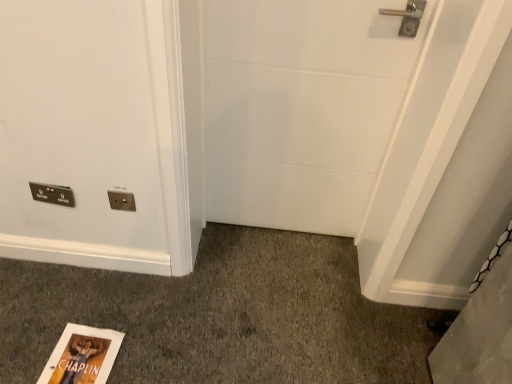
Measure the distance between metallic silver light switch at lower left and camera.

metallic silver light switch at lower left and camera are 4.78 feet apart.

Identify the location of white matte door at center. (301, 108).

Identify the location of matte gold electrical outlet at center. The height and width of the screenshot is (384, 512). (121, 201).

From the image's perspective, is white matte door at center located above matte gold electrical outlet at center?

Yes, from the image's perspective, white matte door at center is on top of matte gold electrical outlet at center.

Considering the relative positions of white matte door at center and matte gold electrical outlet at center in the image provided, is white matte door at center to the right of matte gold electrical outlet at center from the viewer's perspective?

Yes, white matte door at center is to the right of matte gold electrical outlet at center.

From the picture: Who is smaller, white matte door at center or matte gold electrical outlet at center?

matte gold electrical outlet at center is smaller.

Considering the positions of point (222, 42) and point (129, 197), is point (222, 42) closer or farther from the camera than point (129, 197)?

Point (222, 42).

Is matte gold electrical outlet at center positioned far away from metallic silver light switch at lower left?

No, matte gold electrical outlet at center is not far away from metallic silver light switch at lower left.

From the image's perspective, which is below, matte gold electrical outlet at center or metallic silver light switch at lower left?

matte gold electrical outlet at center.

The image size is (512, 384). Find the location of `electric outlet in front of the metallic silver light switch at lower left`. electric outlet in front of the metallic silver light switch at lower left is located at coordinates (121, 201).

Which is behind, matte gold electrical outlet at center or metallic silver light switch at lower left?

metallic silver light switch at lower left is further from the camera.

Consider the image. Which is more to the right, metallic silver light switch at lower left or matte gold electrical outlet at center?

Positioned to the right is matte gold electrical outlet at center.

Considering the relative sizes of metallic silver light switch at lower left and matte gold electrical outlet at center in the image provided, is metallic silver light switch at lower left wider than matte gold electrical outlet at center?

Indeed, metallic silver light switch at lower left has a greater width compared to matte gold electrical outlet at center.

Which of these two, metallic silver light switch at lower left or matte gold electrical outlet at center, stands shorter?

With less height is matte gold electrical outlet at center.

From the image's perspective, between white matte door at center and metallic silver light switch at lower left, which one is located above?

From the image's view, white matte door at center is above.

Could you tell me if white matte door at center is facing metallic silver light switch at lower left?

No, white matte door at center is not turned towards metallic silver light switch at lower left.

Is white matte door at center taller than metallic silver light switch at lower left?

Yes.

Consider the image. Is white matte door at center not near metallic silver light switch at lower left?

No.

Between metallic silver light switch at lower left and white matte door at center, which one has larger width?

With larger width is white matte door at center.

Considering the sizes of objects metallic silver light switch at lower left and white matte door at center in the image provided, who is shorter, metallic silver light switch at lower left or white matte door at center?

With less height is metallic silver light switch at lower left.

What's the angular difference between metallic silver light switch at lower left and white matte door at center's facing directions?

They differ by 0.452 degrees in their facing directions.

From a real-world perspective, is metallic silver light switch at lower left positioned above or below white matte door at center?

metallic silver light switch at lower left is situated lower than white matte door at center in the real world.

Consider the image. From a real-world perspective, is matte gold electrical outlet at center positioned under white matte door at center based on gravity?

Yes, from a real-world perspective, matte gold electrical outlet at center is under white matte door at center.

Considering the sizes of objects matte gold electrical outlet at center and white matte door at center in the image provided, who is smaller, matte gold electrical outlet at center or white matte door at center?

With smaller size is matte gold electrical outlet at center.

Is matte gold electrical outlet at center not near white matte door at center?

They are positioned close to each other.

Is point (117, 193) positioned behind point (256, 116)?

No, it is in front of (256, 116).

Locate an element on the screen. This screenshot has height=384, width=512. electric outlet lying on the left of white matte door at center is located at coordinates (121, 201).

Identify the location of electric outlet that appears in front of the metallic silver light switch at lower left. (121, 201).

Estimate the real-world distances between objects in this image. Which object is further from matte gold electrical outlet at center, metallic silver light switch at lower left or white matte door at center?

Based on the image, white matte door at center appears to be further to matte gold electrical outlet at center.

From the image, which object appears to be nearer to matte gold electrical outlet at center, white matte door at center or metallic silver light switch at lower left?

metallic silver light switch at lower left lies closer to matte gold electrical outlet at center than the other object.

Considering their positions, is matte gold electrical outlet at center positioned closer to metallic silver light switch at lower left than white matte door at center?

Based on the image, matte gold electrical outlet at center appears to be nearer to metallic silver light switch at lower left.

From the image, which object appears to be farther from white matte door at center, metallic silver light switch at lower left or matte gold electrical outlet at center?

Among the two, metallic silver light switch at lower left is located further to white matte door at center.

From the picture: Estimate the real-world distances between objects in this image. Which object is closer to metallic silver light switch at lower left, white matte door at center or matte gold electrical outlet at center?

Among the two, matte gold electrical outlet at center is located nearer to metallic silver light switch at lower left.

Considering their positions, is matte gold electrical outlet at center positioned further to white matte door at center than metallic silver light switch at lower left?

metallic silver light switch at lower left is further to white matte door at center.

You are a GUI agent. You are given a task and a screenshot of the screen. Output one action in this format:
    pyautogui.click(x=<x>, y=<y>)
    Task: Click on the electric outlet between metallic silver light switch at lower left and white matte door at center in the horizontal direction
    This screenshot has height=384, width=512.
    Given the screenshot: What is the action you would take?
    pyautogui.click(x=121, y=201)